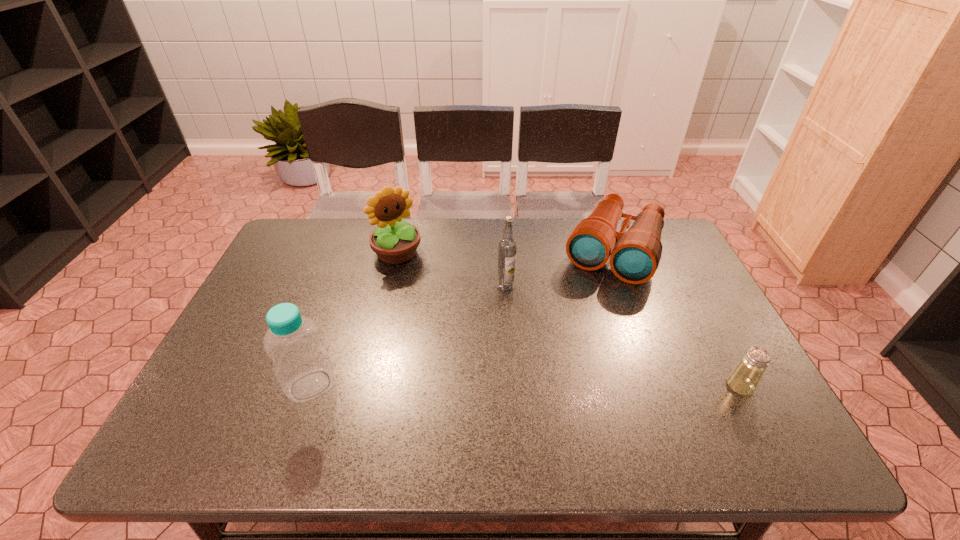
Locate an element on the screen. free space located on the face of the sunflower is located at coordinates (481, 350).

I want to click on vacant area situated 0.360m on the face of the sunflower, so 472,340.

The image size is (960, 540). What are the coordinates of `vacant space situated 0.150m on the face of the sunflower` in the screenshot? It's located at (432, 294).

Find the location of a particular element. vacant space situated through the lenses of the binoculars is located at coordinates (582, 323).

Locate an element on the screen. The image size is (960, 540). vacant space positioned 0.170m through the lenses of the binoculars is located at coordinates (582, 323).

Locate an element on the screen. The height and width of the screenshot is (540, 960). vacant region located through the lenses of the binoculars is located at coordinates (581, 326).

Find the location of a particular element. sunflower at the far edge is located at coordinates (394, 241).

I want to click on binoculars that is at the far edge, so click(635, 254).

Identify the location of bottle that is positioned at the near edge. This screenshot has width=960, height=540. (302, 366).

You are a GUI agent. You are given a task and a screenshot of the screen. Output one action in this format:
    pyautogui.click(x=<x>, y=<y>)
    Task: Click on the saltshaker that is at the near edge
    
    Given the screenshot: What is the action you would take?
    pyautogui.click(x=744, y=379)